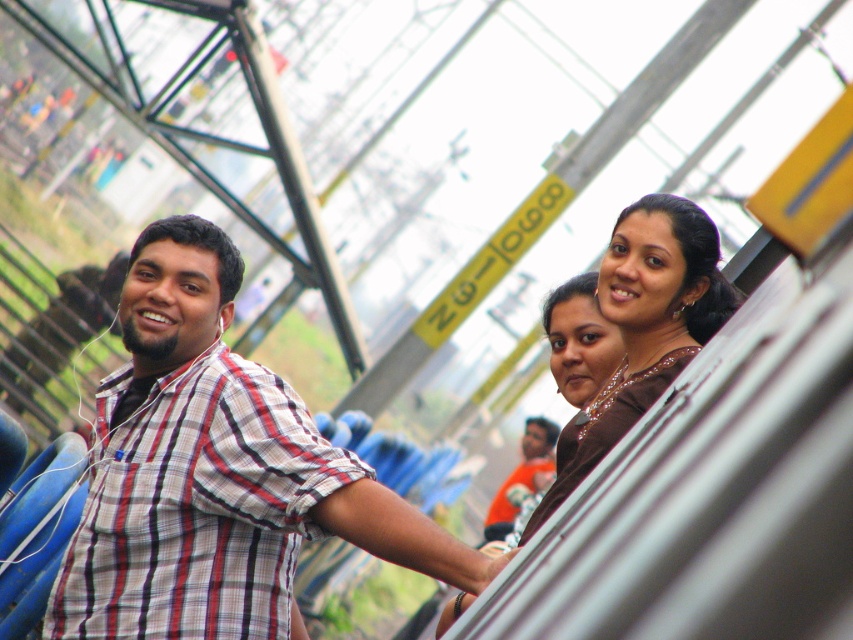
You are a photographer setting up a shoot at a stadium. You notice two items in the frame, the brown satin dress at upper right and the orange shirt at center. Which item appears smaller in the image?

The brown satin dress at upper right is smaller than the orange shirt at center in the image.